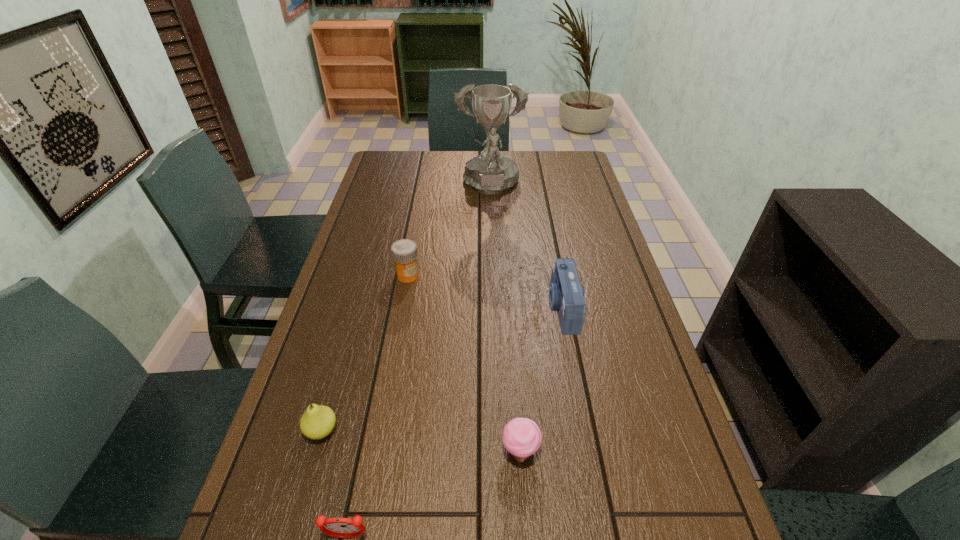
Identify the location of vacant area situated 0.260m on the lens of the rightmost object. The height and width of the screenshot is (540, 960). (454, 308).

Where is `vacant area situated on the label side of the medicine`? This screenshot has height=540, width=960. vacant area situated on the label side of the medicine is located at coordinates (389, 382).

Identify the location of free point located on the left of the pear. (277, 430).

Image resolution: width=960 pixels, height=540 pixels. What are the coordinates of `blank space located on the back of the cupcake` in the screenshot? It's located at (511, 311).

Find the location of a particular element. object that is at the far edge is located at coordinates (491, 172).

The height and width of the screenshot is (540, 960). In order to click on object that is at the left edge in this screenshot , I will do `click(318, 421)`.

You are a GUI agent. You are given a task and a screenshot of the screen. Output one action in this format:
    pyautogui.click(x=<x>, y=<y>)
    Task: Click on the free space at the left edge
    
    Given the screenshot: What is the action you would take?
    pyautogui.click(x=261, y=477)

Locate an element on the screen. Image resolution: width=960 pixels, height=540 pixels. vacant space at the right edge of the desktop is located at coordinates (636, 380).

Image resolution: width=960 pixels, height=540 pixels. What are the coordinates of `free space between the leftmost object and the medicine` in the screenshot? It's located at coord(365,353).

Identify the location of blank region between the second farthest object and the camera. The image size is (960, 540). (485, 292).